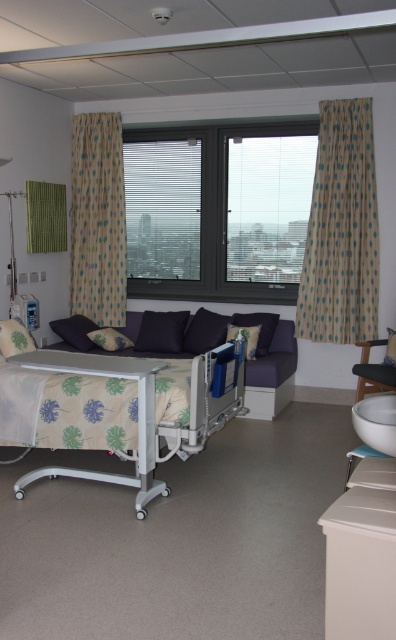
You are a nurse entering the hospital room and need to place a medical chart on the closest object to the window. Which object should you choose between the dark purple cushion at center left and the blue fabric pillow at center?

The dark purple cushion at center left is closer to the window than the blue fabric pillow at center, so the nurse should place the medical chart on the dark purple cushion at center left.

You are a nurse entering the hospital room and need to adjust the height of the polka dot fabric curtain at left to ensure it covers the window properly. Considering the dark fabric pillow at center is placed on the sofa, which is near the window, can the curtain reach the required height to cover the window?

The polka dot fabric curtain at left is much taller than the dark fabric pillow at center. Since the dark fabric pillow at center is placed on the sofa near the window, the curtain should be able to reach the required height to cover the window as it is taller than the pillow, which is positioned near the window area.

You are a nurse in a hospital room. You need to place a camera 5.76 meters away from the polka dot fabric curtain at left. Where should you position the camera?

The camera should be placed 5.76 meters away from the polka dot fabric curtain at left as specified in the description.